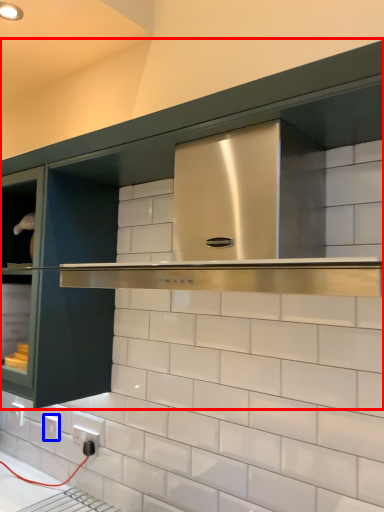
Question: Which point is further to the camera, cabinetry (highlighted by a red box) or electric outlet (highlighted by a blue box)?

Choices:
 (A) cabinetry
 (B) electric outlet

Answer: (B)